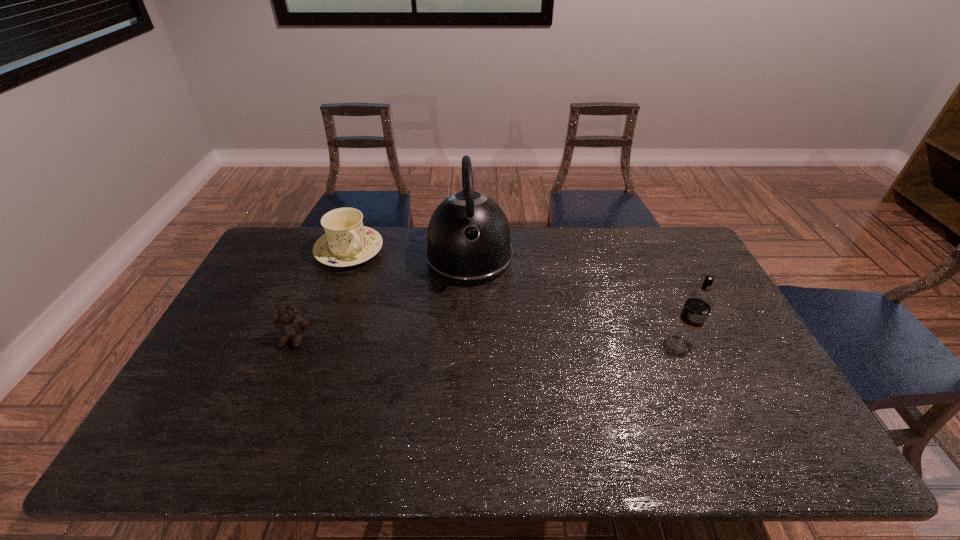
Locate an element on the screen. teddy bear is located at coordinates (292, 327).

Image resolution: width=960 pixels, height=540 pixels. I want to click on the rightmost object, so click(699, 302).

Find the location of a particular element. This screenshot has height=540, width=960. the third shortest object is located at coordinates (699, 302).

The height and width of the screenshot is (540, 960). Identify the location of kettle. (468, 243).

At what (x,y) coordinates should I click in order to perform the action: click on the third object from left to right. Please return your answer as a coordinate pair (x, y). Looking at the image, I should click on (468, 243).

The height and width of the screenshot is (540, 960). I want to click on chinaware, so click(346, 242).

Locate an element on the screen. blank space located 0.090m on the face of the teddy bear is located at coordinates (278, 376).

You are a GUI agent. You are given a task and a screenshot of the screen. Output one action in this format:
    pyautogui.click(x=<x>, y=<y>)
    Task: Click on the vacant space located on the label of the rightmost object
    Image resolution: width=960 pixels, height=540 pixels.
    Given the screenshot: What is the action you would take?
    pyautogui.click(x=700, y=377)

The height and width of the screenshot is (540, 960). Find the location of `vacant area situated on the spout of the tallest object`. vacant area situated on the spout of the tallest object is located at coordinates (477, 340).

Identify the location of free space located 0.100m on the spout of the tallest object. (474, 313).